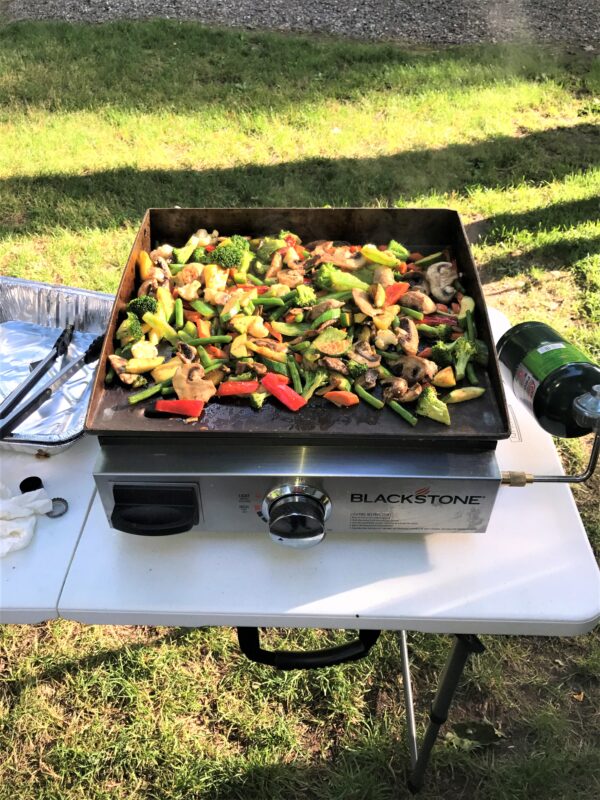
You are a GUI agent. You are given a task and a screenshot of the screen. Output one action in this format:
    pyautogui.click(x=<x>, y=<y>)
    Task: Click on the table
    This screenshot has height=800, width=600.
    Given the screenshot: What is the action you would take?
    pyautogui.click(x=206, y=570)